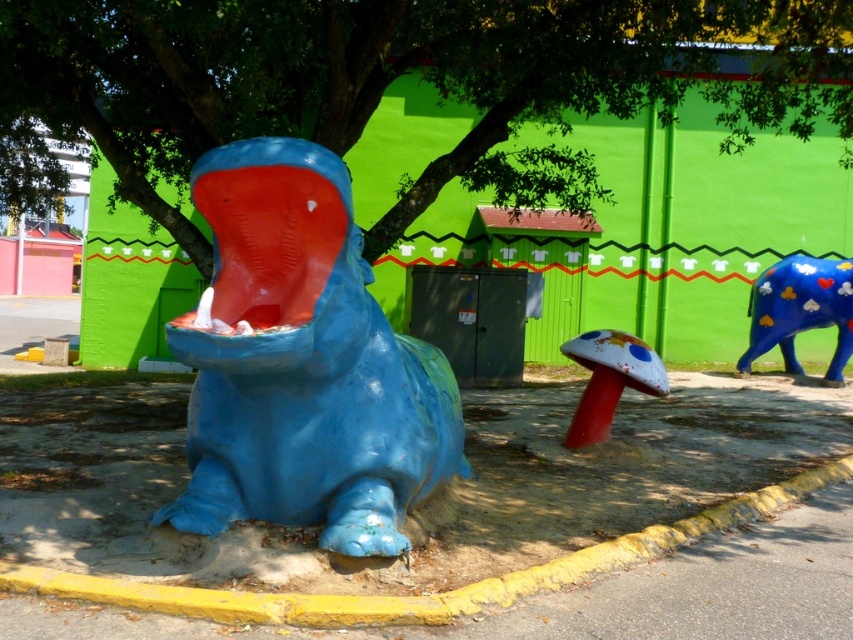
Question: Which is nearer to the yellow painted curb at lower left?

Choices:
 (A) smooth red mushroom at center
 (B) blue glossy hippo at center
 (C) blue glossy elephant at right
 (D) green leafy tree at upper center

Answer: (B)

Question: Observing the image, what is the correct spatial positioning of green leafy tree at upper center in reference to blue glossy elephant at right?

Choices:
 (A) left
 (B) right

Answer: (A)

Question: Is green leafy tree at upper center above blue glossy hippo at center?

Choices:
 (A) no
 (B) yes

Answer: (B)

Question: Considering the real-world distances, which object is closest to the green leafy tree at upper center?

Choices:
 (A) smooth red mushroom at center
 (B) yellow painted curb at lower left
 (C) blue glossy hippo at center
 (D) blue glossy elephant at right

Answer: (C)

Question: Is blue glossy hippo at center to the left of blue glossy elephant at right from the viewer's perspective?

Choices:
 (A) no
 (B) yes

Answer: (B)

Question: Which of these objects is positioned closest to the smooth red mushroom at center?

Choices:
 (A) blue glossy hippo at center
 (B) green leafy tree at upper center

Answer: (A)